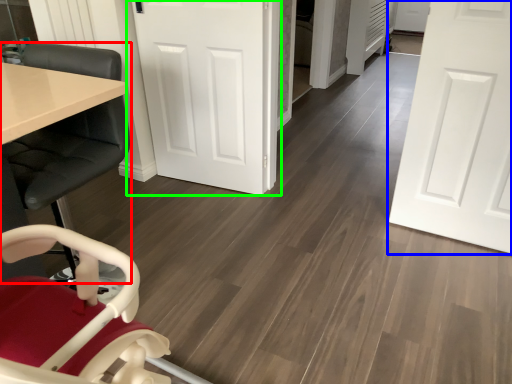
Question: Estimate the real-world distances between objects in this image. Which object is closer to chair (highlighted by a red box), door (highlighted by a blue box) or door (highlighted by a green box)?

Choices:
 (A) door
 (B) door

Answer: (B)